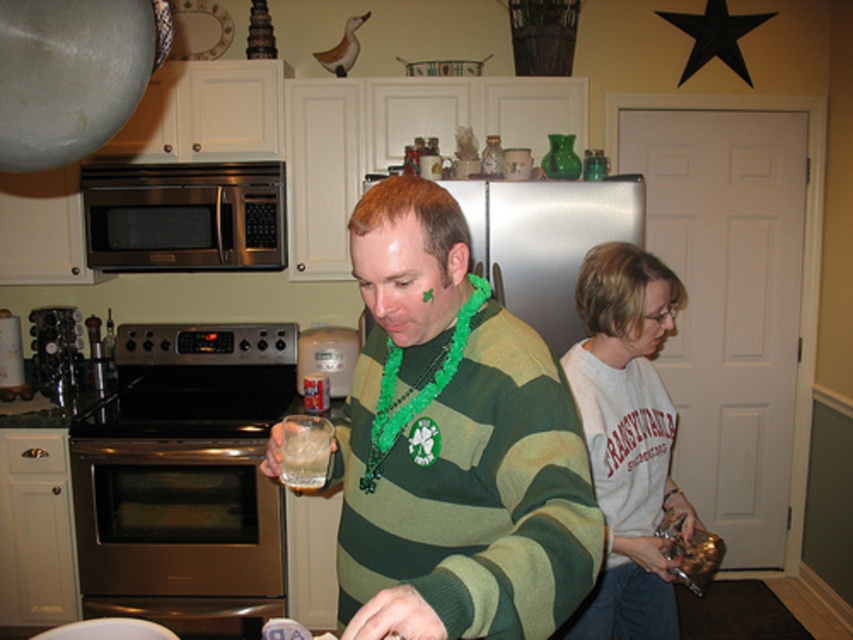
Between white cotton shirt at right and silver metallic exhaust hood at upper left, which one has less height?

With less height is silver metallic exhaust hood at upper left.

Who is positioned more to the right, white cotton shirt at right or silver metallic exhaust hood at upper left?

Positioned to the right is white cotton shirt at right.

Where is `white cotton shirt at right`? The height and width of the screenshot is (640, 853). white cotton shirt at right is located at coordinates (627, 440).

Where is `white cotton shirt at right`? This screenshot has height=640, width=853. white cotton shirt at right is located at coordinates pyautogui.click(x=627, y=440).

Measure the distance from silver metallic exhaust hood at upper left to clear glass at center.

silver metallic exhaust hood at upper left and clear glass at center are 23.42 inches apart from each other.

Is silver metallic exhaust hood at upper left bigger than clear glass at center?

Indeed, silver metallic exhaust hood at upper left has a larger size compared to clear glass at center.

Does point (51, 0) come closer to viewer compared to point (289, 435)?

Yes, point (51, 0) is closer to viewer.

Locate an element on the screen. silver metallic exhaust hood at upper left is located at coordinates [73, 74].

Can you confirm if green matte sweater at center is smaller than white cotton shirt at right?

Incorrect, green matte sweater at center is not smaller in size than white cotton shirt at right.

Can you confirm if green matte sweater at center is positioned below white cotton shirt at right?

Actually, green matte sweater at center is above white cotton shirt at right.

Between point (390, 209) and point (572, 364), which one is positioned behind?

The point (572, 364) is behind.

This screenshot has height=640, width=853. I want to click on green matte sweater at center, so click(x=453, y=445).